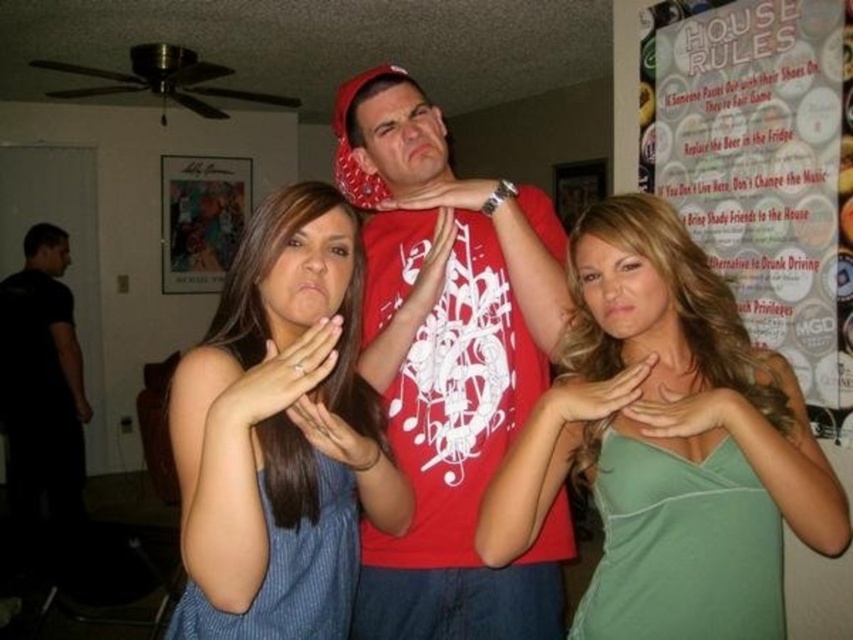
Measure the distance between point (x=207, y=570) and camera.

The distance of point (x=207, y=570) from camera is 34.14 inches.

Is blue striped tank top at center below white paper poster at upper right?

Yes, blue striped tank top at center is below white paper poster at upper right.

At what (x,y) coordinates should I click in order to perform the action: click on blue striped tank top at center. Please return your answer as a coordinate pair (x, y). The height and width of the screenshot is (640, 853). Looking at the image, I should click on (280, 433).

Is blue striped tank top at center positioned behind black matte shirt at left?

No, it is not.

Is point (283, 266) closer to camera compared to point (32, 310)?

Yes, it is in front of point (32, 310).

Where is `blue striped tank top at center`? The height and width of the screenshot is (640, 853). blue striped tank top at center is located at coordinates (280, 433).

Which is below, green satin tank top at center or white paper poster at upper right?

green satin tank top at center

Who is taller, green satin tank top at center or white paper poster at upper right?

With more height is white paper poster at upper right.

Does point (558, 378) lie behind point (764, 268)?

No, it is in front of (764, 268).

Locate an element on the screen. The image size is (853, 640). green satin tank top at center is located at coordinates (666, 436).